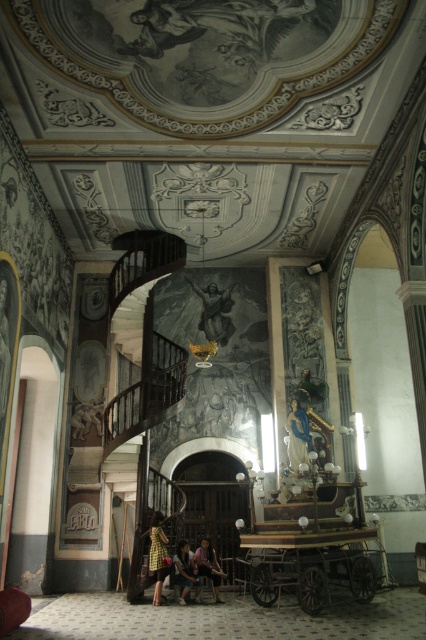
You are an interior designer planning to install a new light fixture in the church. The light fixture must be placed above the blue fabric statue at center and the dark brown leather chair at center. Considering their heights, which object requires the light fixture to be installed higher?

The blue fabric statue at center requires the light fixture to be installed higher because it is much taller than the dark brown leather chair at center.

You are an interior designer planning to rearrange the items in the church. You need to place a large rectangular table that requires 2 meters of space. Which object between the blue fabric statue at center and the dark brown leather chair at center would you move to accommodate the table?

The blue fabric statue at center occupies less space than the dark brown leather chair at center, so moving the dark brown leather chair at center would free up more space to accommodate the large rectangular table.

You are standing at the base of the spiral staircase in the church. You want to take a photo of the large circular fresco on the ceiling using your camera. The fresco is 9 meters above the ground. Your camera has a maximum zoom range that allows you to capture objects up to 10 meters away. However, there is a light brown fabric skirt at lower center in your path. Is the distance between you and the camera sufficient to capture the fresco without the skirt blocking the view?

The distance between you and the camera is 9.79 meters, which is within the camera maximum zoom range of 10 meters. Therefore, you can capture the fresco without the skirt blocking the view.